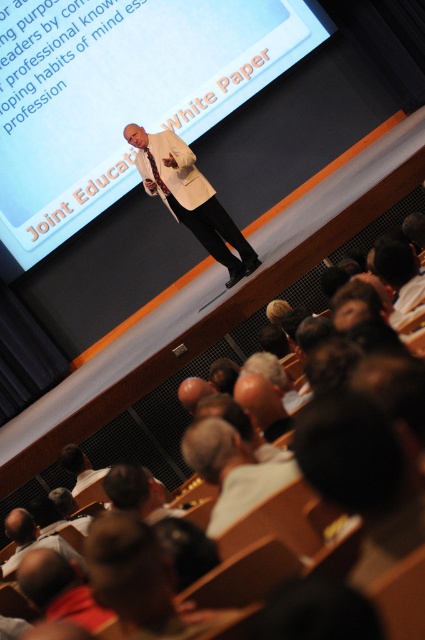
Question: Is white paper at upper center positioned before white matte shirt at center?

Choices:
 (A) no
 (B) yes

Answer: (A)

Question: Observing the image, what is the correct spatial positioning of white matte jacket at center in reference to white matte shirt at lower left?

Choices:
 (A) left
 (B) right

Answer: (B)

Question: Considering the real-world distances, which object is closest to the white paper at upper center?

Choices:
 (A) white matte shirt at center
 (B) white matte shirt at lower left
 (C) white matte jacket at center

Answer: (C)

Question: Among these points, which one is farthest from the camera?

Choices:
 (A) (87, 470)
 (B) (87, 200)
 (C) (155, 150)

Answer: (B)

Question: Is white paper at upper center positioned behind white matte shirt at center?

Choices:
 (A) yes
 (B) no

Answer: (A)

Question: Which object appears farthest from the camera in this image?

Choices:
 (A) white matte shirt at lower left
 (B) white matte jacket at center
 (C) white paper at upper center

Answer: (C)